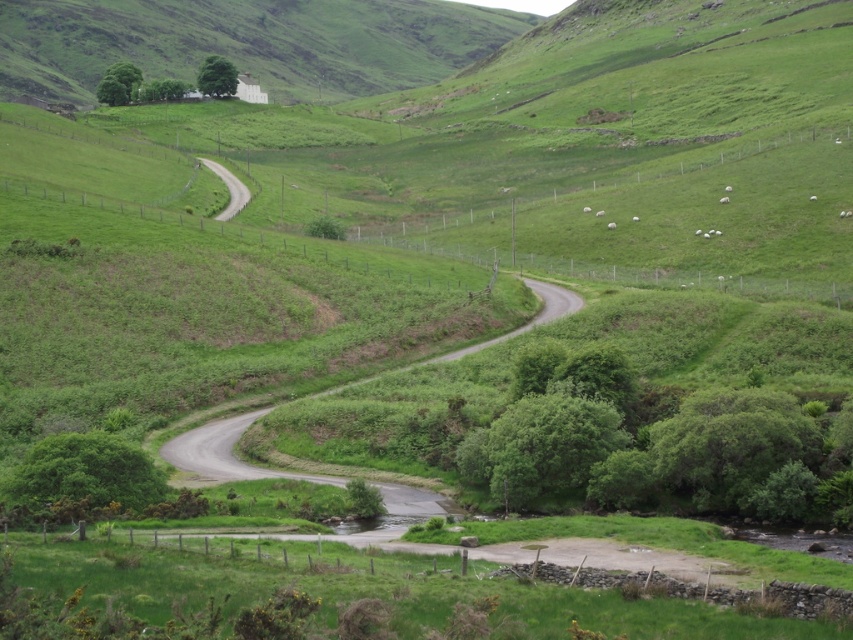
Question: Is gray asphalt road at center to the right of white woolly sheep at center from the viewer's perspective?

Choices:
 (A) no
 (B) yes

Answer: (A)

Question: Which object appears farthest from the camera in this image?

Choices:
 (A) white woolly sheep at center
 (B) gray asphalt road at center
 (C) green grassy hillside at upper center

Answer: (C)

Question: Which object is farther from the camera taking this photo?

Choices:
 (A) gray asphalt road at center
 (B) white woolly sheep at center

Answer: (B)

Question: Which object appears farthest from the camera in this image?

Choices:
 (A) gray asphalt road at center
 (B) white woolly sheep at center

Answer: (B)

Question: Can you confirm if green grassy hillside at upper center is thinner than white woolly sheep at center?

Choices:
 (A) no
 (B) yes

Answer: (A)

Question: Can you confirm if green grassy hillside at upper center is positioned to the left of white woolly sheep at center?

Choices:
 (A) no
 (B) yes

Answer: (B)